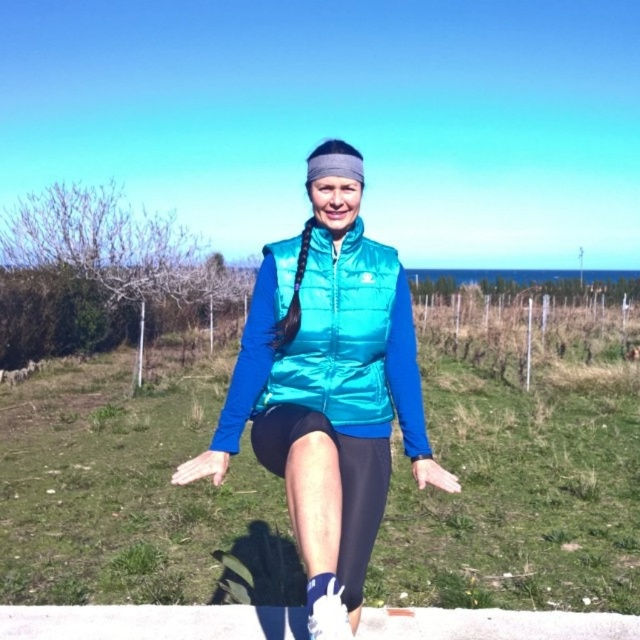
Question: Which of these objects is positioned farthest from the black spandex leggings at center?

Choices:
 (A) metallic teal vest at center
 (B) teal quilted vest at center

Answer: (B)

Question: Can you confirm if teal quilted vest at center is positioned to the right of black spandex leggings at center?

Choices:
 (A) yes
 (B) no

Answer: (B)

Question: From the image, what is the correct spatial relationship of metallic teal vest at center in relation to teal quilted vest at center?

Choices:
 (A) left
 (B) right

Answer: (B)

Question: Based on their relative distances, which object is farther from the teal quilted vest at center?

Choices:
 (A) black spandex leggings at center
 (B) metallic teal vest at center

Answer: (A)

Question: Which point is closer to the camera?

Choices:
 (A) teal quilted vest at center
 (B) black spandex leggings at center
 (C) metallic teal vest at center

Answer: (C)

Question: Does metallic teal vest at center have a lesser width compared to teal quilted vest at center?

Choices:
 (A) yes
 (B) no

Answer: (B)